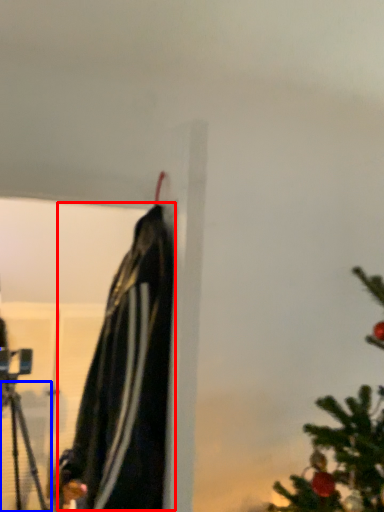
Question: Which object is closer to the camera taking this photo, cloak (highlighted by a red box) or tripod (highlighted by a blue box)?

Choices:
 (A) cloak
 (B) tripod

Answer: (A)